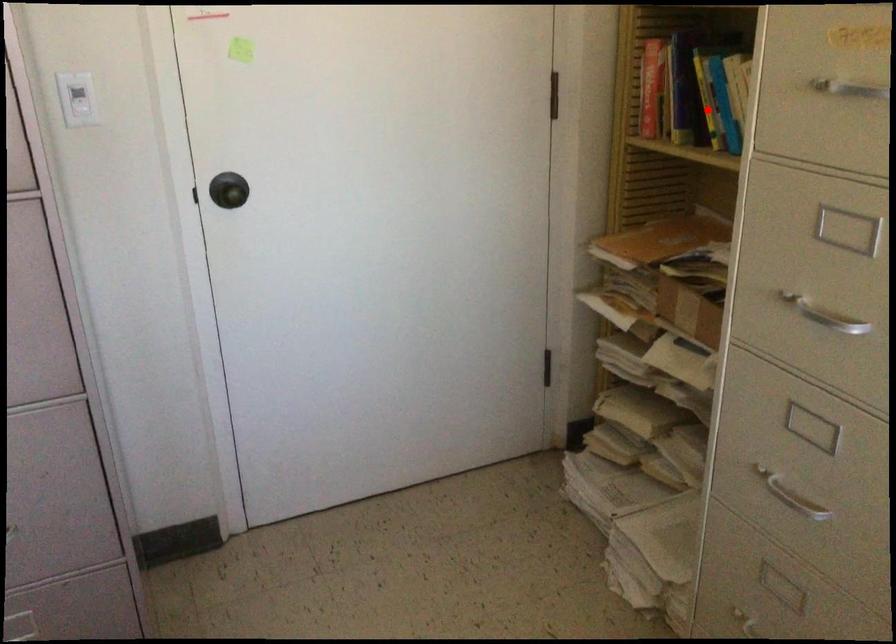
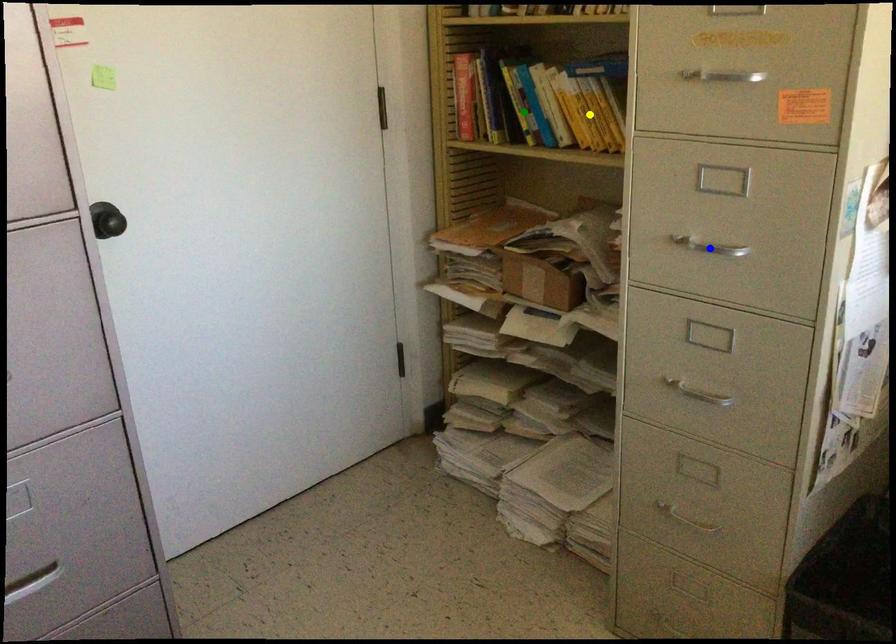
Question: I am providing you with two images of the same scene from different viewpoints. A red point is marked on the first image. You are given multiple points on the second image. Which spot in image 2 lines up with the point in image 1?

Choices:
 (A) yellow point
 (B) blue point
 (C) green point

Answer: (C)